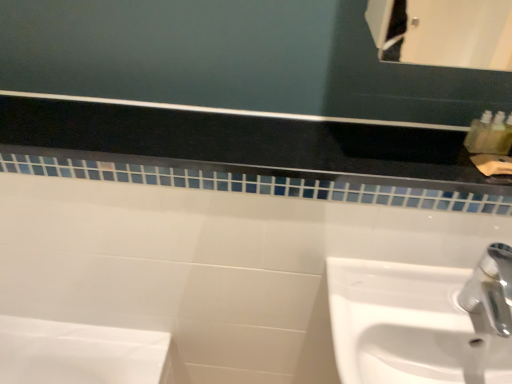
Question: Is white glossy tile at upper center inside the boundaries of white glossy sink at lower right, or outside?

Choices:
 (A) outside
 (B) inside

Answer: (A)

Question: In terms of size, does white glossy tile at upper center appear bigger or smaller than white glossy sink at lower right?

Choices:
 (A) small
 (B) big

Answer: (A)

Question: Based on their positions, is white glossy tile at upper center located to the left or right of white glossy sink at lower right?

Choices:
 (A) left
 (B) right

Answer: (A)

Question: From a real-world perspective, relative to white glossy tile at upper center, is white glossy sink at lower right vertically above or below?

Choices:
 (A) above
 (B) below

Answer: (B)

Question: Based on their sizes in the image, would you say white glossy sink at lower right is bigger or smaller than white glossy tile at upper center?

Choices:
 (A) small
 (B) big

Answer: (B)

Question: From the image's perspective, is white glossy sink at lower right above or below white glossy tile at upper center?

Choices:
 (A) above
 (B) below

Answer: (B)

Question: Is white glossy sink at lower right taller or shorter than white glossy tile at upper center?

Choices:
 (A) short
 (B) tall

Answer: (B)